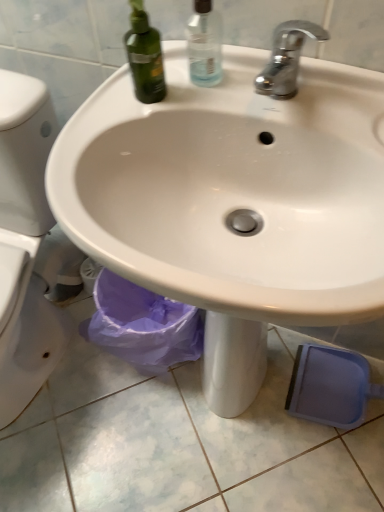
Question: Can you confirm if chrome metallic faucet at upper center is bigger than white glossy sink at center?

Choices:
 (A) no
 (B) yes

Answer: (A)

Question: Does chrome metallic faucet at upper center lie behind white glossy sink at center?

Choices:
 (A) no
 (B) yes

Answer: (B)

Question: Is chrome metallic faucet at upper center completely or partially outside of white glossy sink at center?

Choices:
 (A) yes
 (B) no

Answer: (A)

Question: From a real-world perspective, is chrome metallic faucet at upper center under white glossy sink at center?

Choices:
 (A) yes
 (B) no

Answer: (B)

Question: Considering the relative sizes of chrome metallic faucet at upper center and white glossy sink at center in the image provided, is chrome metallic faucet at upper center taller than white glossy sink at center?

Choices:
 (A) no
 (B) yes

Answer: (A)

Question: From the image's perspective, is transparent plastic spray bottle at upper center located above or below white glossy sink at center?

Choices:
 (A) below
 (B) above

Answer: (B)

Question: Is transparent plastic spray bottle at upper center inside the boundaries of white glossy sink at center, or outside?

Choices:
 (A) outside
 (B) inside

Answer: (A)

Question: Is point (216, 59) positioned closer to the camera than point (350, 159)?

Choices:
 (A) farther
 (B) closer

Answer: (A)

Question: Looking at their shapes, would you say transparent plastic spray bottle at upper center is wider or thinner than white glossy sink at center?

Choices:
 (A) wide
 (B) thin

Answer: (B)

Question: Considering the relative positions of white glossy sink at center and transparent plastic spray bottle at upper center in the image provided, is white glossy sink at center to the left or to the right of transparent plastic spray bottle at upper center?

Choices:
 (A) right
 (B) left

Answer: (A)

Question: From a real-world perspective, relative to transparent plastic spray bottle at upper center, is white glossy sink at center vertically above or below?

Choices:
 (A) below
 (B) above

Answer: (A)

Question: Is white glossy sink at center situated inside transparent plastic spray bottle at upper center or outside?

Choices:
 (A) outside
 (B) inside

Answer: (A)

Question: In the image, is white glossy sink at center positioned in front of or behind transparent plastic spray bottle at upper center?

Choices:
 (A) behind
 (B) front

Answer: (B)

Question: Considering their positions, is white glossy sink at center located in front of or behind chrome metallic faucet at upper center?

Choices:
 (A) front
 (B) behind

Answer: (A)

Question: In terms of width, does white glossy sink at center look wider or thinner when compared to chrome metallic faucet at upper center?

Choices:
 (A) wide
 (B) thin

Answer: (A)